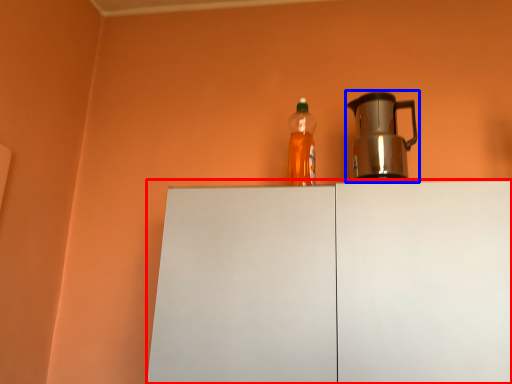
Question: Which object appears farthest to the camera in this image, cabinetry (highlighted by a red box) or kettle (highlighted by a blue box)?

Choices:
 (A) cabinetry
 (B) kettle

Answer: (B)